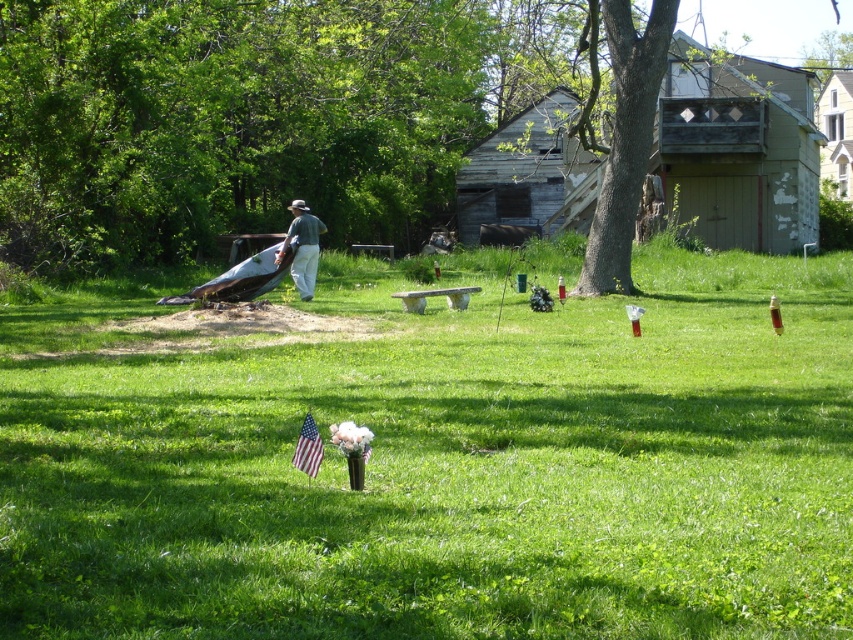
Is green leafy tree at upper left bigger than green cotton shirt at center?

Correct, green leafy tree at upper left is larger in size than green cotton shirt at center.

Is green leafy tree at upper left taller than green cotton shirt at center?

Indeed, green leafy tree at upper left has a greater height compared to green cotton shirt at center.

Between point (99, 208) and point (312, 225), which one is positioned behind?

Point (99, 208)

Where is `green leafy tree at upper left`? This screenshot has width=853, height=640. green leafy tree at upper left is located at coordinates (225, 120).

Is wooden bench at center to the left of green leafy tree at upper left from the viewer's perspective?

No, wooden bench at center is not to the left of green leafy tree at upper left.

Which of these two, wooden bench at center or green leafy tree at upper left, stands shorter?

wooden bench at center is shorter.

Where is `wooden bench at center`? wooden bench at center is located at coordinates (445, 467).

Which is more to the left, green leafy tree at upper left or american flag at center?

From the viewer's perspective, green leafy tree at upper left appears more on the left side.

Does green leafy tree at upper left have a larger size compared to american flag at center?

Indeed, green leafy tree at upper left has a larger size compared to american flag at center.

Who is more forward, (396, 195) or (305, 428)?

Point (305, 428)

The width and height of the screenshot is (853, 640). I want to click on green leafy tree at upper left, so click(x=225, y=120).